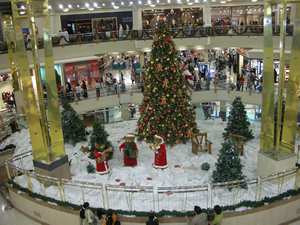
Locate an element on the screen. doorway is located at coordinates (82, 75), (124, 76), (115, 75), (117, 112), (250, 111), (218, 107), (260, 66), (241, 21), (84, 28).